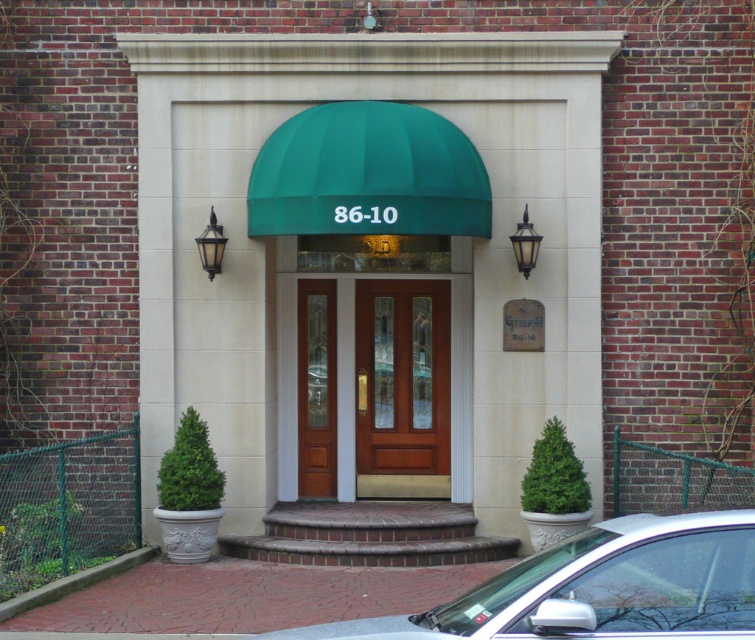
You are a delivery person with a package that requires a 1 meter wide path to pass through. You are standing in front of the entrance and see the mahogany wood door at center and the brown wood door at center. Can you determine if the space between these two doors is wide enough for your delivery vehicle?

The distance between the mahogany wood door at center and the brown wood door at center is 50.20 centimeters, which is narrower than the required 1 meter. Therefore, the delivery vehicle cannot pass through the space between them.

You are driving a white glossy car at lower center that is 16 feet long. You want to park it in the space between the two symmetrical wall mounted lantern style lights flanking the green awning. Can you park the car there?

The distance between the two symmetrical wall mounted lantern style lights flanking the green awning is 16.81 feet. Since the white glossy car at lower center is 16 feet long, it can fit in the space between them as the available space is slightly wider than the car.